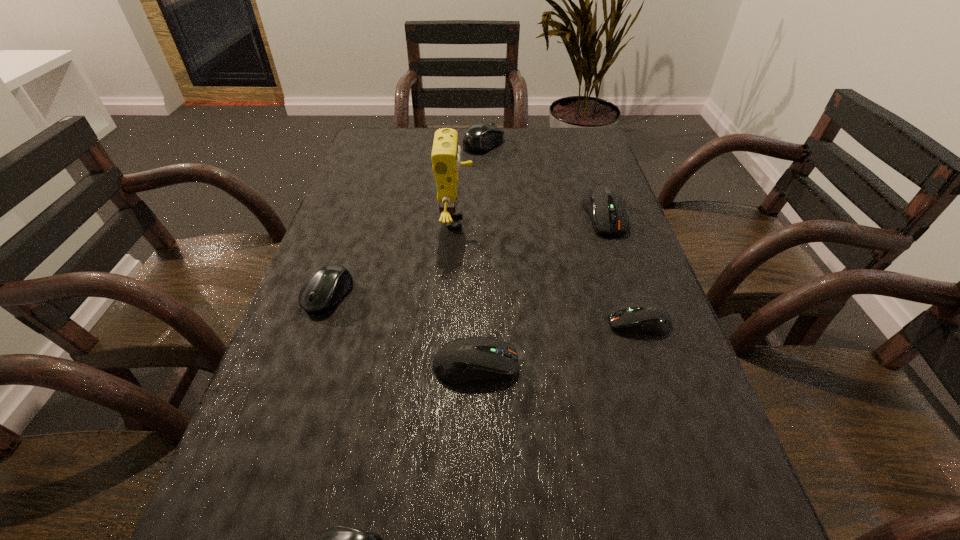
In order to click on free region at the left edge in this screenshot , I will do `click(331, 220)`.

At what (x,y) coordinates should I click in order to perform the action: click on vacant space at the right edge of the desktop. Please return your answer as a coordinate pair (x, y). Image resolution: width=960 pixels, height=540 pixels. Looking at the image, I should click on (688, 475).

This screenshot has height=540, width=960. I want to click on vacant space at the far right corner of the desktop, so click(x=567, y=134).

This screenshot has width=960, height=540. I want to click on free spot between the second smallest black mouse and the second nearest mouse, so click(402, 330).

Find the location of a particular element. The width and height of the screenshot is (960, 540). free spot between the tallest object and the farthest black mouse is located at coordinates (469, 183).

The width and height of the screenshot is (960, 540). In order to click on empty space that is in between the tallest object and the second nearest object in this screenshot , I will do `click(466, 294)`.

Find the location of a particular element. The width and height of the screenshot is (960, 540). vacant area between the biggest dark computer equipment and the rightmost black mouse is located at coordinates (544, 179).

Where is `empty location between the second farthest black mouse and the nearest dark computer equipment`? The image size is (960, 540). empty location between the second farthest black mouse and the nearest dark computer equipment is located at coordinates 402,330.

You are a GUI agent. You are given a task and a screenshot of the screen. Output one action in this format:
    pyautogui.click(x=<x>, y=<y>)
    Task: Click on the free area in between the smallest dark computer equipment and the second farthest mouse
    The width and height of the screenshot is (960, 540).
    Given the screenshot: What is the action you would take?
    (622, 269)

The image size is (960, 540). Identify the location of empty space between the second smallest dark computer equipment and the farthest object. (480, 254).